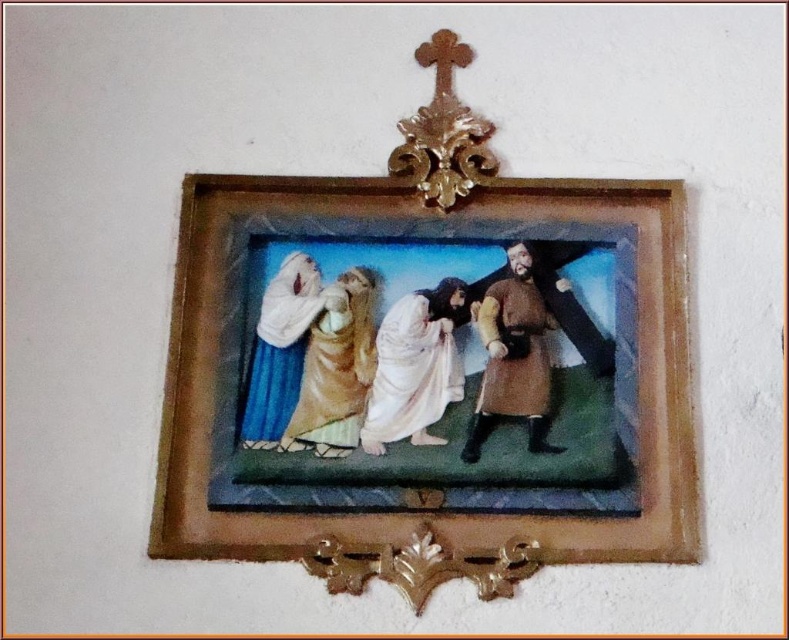
You are an art conservator examining the framed religious artwork on the wall. You notice two elements at the center of the frame. One is the white clothed figure at center and the other is the matte gold robe at center. Based on their positions, which one do you think is wider?

The white clothed figure at center is wider than the matte gold robe at center according to the description provided.